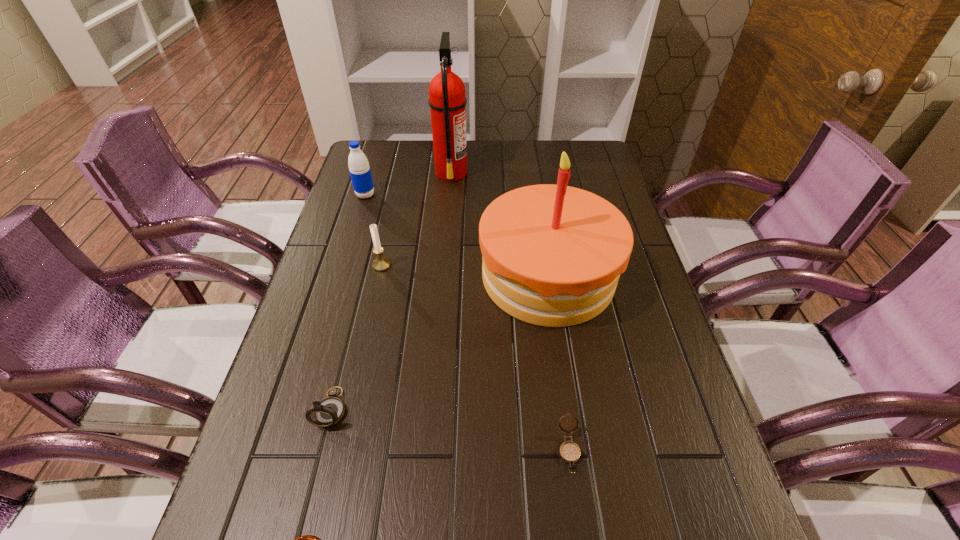
In order to click on free space located on the front of the birthday cake in this screenshot , I will do `click(564, 381)`.

Find the location of a particular element. Image resolution: width=960 pixels, height=540 pixels. vacant area situated 0.340m on the front of the water bottle is located at coordinates (339, 280).

You are a GUI agent. You are given a task and a screenshot of the screen. Output one action in this format:
    pyautogui.click(x=<x>, y=<y>)
    Task: Click on the vacant space located 0.310m on the right of the fourth shortest object
    
    Given the screenshot: What is the action you would take?
    pyautogui.click(x=508, y=265)

At what (x,y) coordinates should I click in order to perform the action: click on free space located on the face of the fifth tallest object. Please return your answer as a coordinate pair (x, y). Looking at the image, I should click on (320, 457).

Where is `vacant position located 0.090m on the face of the second shortest compass`? This screenshot has height=540, width=960. vacant position located 0.090m on the face of the second shortest compass is located at coordinates (581, 531).

Find the location of `object present at the far edge`. object present at the far edge is located at coordinates (447, 101).

I want to click on water bottle that is at the left edge, so click(358, 164).

At what (x,y) coordinates should I click in order to perform the action: click on candle holder that is at the left edge. Please return your answer as a coordinate pair (x, y). The height and width of the screenshot is (540, 960). Looking at the image, I should click on (380, 264).

Identify the location of compass that is at the left edge. Image resolution: width=960 pixels, height=540 pixels. (329, 411).

The image size is (960, 540). Identify the location of object located in the right edge section of the desktop. click(x=552, y=255).